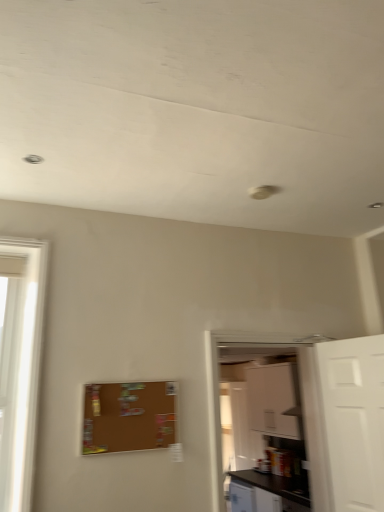
Where is `corkboard at center`? The height and width of the screenshot is (512, 384). corkboard at center is located at coordinates (128, 417).

The image size is (384, 512). Find the location of `white matte door at right`. white matte door at right is located at coordinates (354, 420).

Describe the element at coordinates (274, 400) in the screenshot. I see `white matte cabinet at upper right` at that location.

The height and width of the screenshot is (512, 384). Describe the element at coordinates (304, 406) in the screenshot. I see `white glossy cabinet at right` at that location.

What are the coordinates of `white glossy cabinet at right` in the screenshot? It's located at [x=304, y=406].

You are a GUI agent. You are given a task and a screenshot of the screen. Output one action in this format:
    pyautogui.click(x=<x>, y=<y>)
    Task: Click on the corkboard at center
    
    Given the screenshot: What is the action you would take?
    pyautogui.click(x=128, y=417)

How different are the orientations of white matte cabinet at upper right and corkboard at center in degrees?

The angular difference between white matte cabinet at upper right and corkboard at center is 89.7 degrees.

Is white matte cabinet at upper right looking in the opposite direction of corkboard at center?

white matte cabinet at upper right is not turned away from corkboard at center.

Looking at this image, considering the sizes of white matte cabinet at upper right and corkboard at center in the image, is white matte cabinet at upper right taller or shorter than corkboard at center?

In the image, white matte cabinet at upper right appears to be taller than corkboard at center.

Is white matte cabinet at upper right positioned beyond the bounds of corkboard at center?

Yes.

Is white matte cabinet at upper right positioned in front of black laminate counter top at lower right?

Yes, it is in front of black laminate counter top at lower right.

From a real-world perspective, is white matte cabinet at upper right positioned above or below black laminate counter top at lower right?

white matte cabinet at upper right is situated higher than black laminate counter top at lower right in the real world.

Which is in front, point (251, 381) or point (289, 484)?

The point (289, 484) is more forward.

From the image's perspective, is white matte cabinet at upper right positioned above or below black laminate counter top at lower right?

white matte cabinet at upper right is situated higher than black laminate counter top at lower right in the image.

From a real-world perspective, who is located lower, white matte door at right or white matte cabinet at upper right?

white matte door at right, from a real-world perspective.

From the image's perspective, does white matte door at right appear higher than white matte cabinet at upper right?

Yes, from the image's perspective, white matte door at right is on top of white matte cabinet at upper right.

Between white matte door at right and white matte cabinet at upper right, which one is positioned in front?

white matte door at right.

In terms of width, does black laminate counter top at lower right look wider or thinner when compared to corkboard at center?

black laminate counter top at lower right is wider than corkboard at center.

From a real-world perspective, is black laminate counter top at lower right over corkboard at center?

No, from a real-world perspective, black laminate counter top at lower right is not on top of corkboard at center.

In terms of height, does black laminate counter top at lower right look taller or shorter compared to corkboard at center?

Considering their sizes, black laminate counter top at lower right has more height than corkboard at center.

Which is farther from the camera, (251, 478) or (160, 436)?

The point (251, 478) is more distant.

From a real-world perspective, between white glossy cabinet at right and corkboard at center, who is vertically higher?

From a 3D spatial view, corkboard at center is above.

Could you tell me if white glossy cabinet at right is facing corkboard at center?

No, white glossy cabinet at right is not facing towards corkboard at center.

Is white glossy cabinet at right to the left of corkboard at center from the viewer's perspective?

No, white glossy cabinet at right is not to the left of corkboard at center.

Who is more distant, corkboard at center or white glossy cabinet at right?

white glossy cabinet at right.

Is corkboard at center situated inside white glossy cabinet at right or outside?

corkboard at center is not enclosed by white glossy cabinet at right.

Which object is positioned more to the left, corkboard at center or white glossy cabinet at right?

From the viewer's perspective, corkboard at center appears more on the left side.

From their relative heights in the image, would you say corkboard at center is taller or shorter than white glossy cabinet at right?

Considering their sizes, corkboard at center has less height than white glossy cabinet at right.

Looking at this image, is black laminate counter top at lower right positioned beyond the bounds of white matte door at right?

black laminate counter top at lower right lies outside white matte door at right's area.

Where is `door in front of the black laminate counter top at lower right`? The width and height of the screenshot is (384, 512). door in front of the black laminate counter top at lower right is located at coordinates coord(354,420).

Is black laminate counter top at lower right facing away from white matte door at right?

No, black laminate counter top at lower right is not facing away from white matte door at right.

From the image's perspective, which one is positioned lower, black laminate counter top at lower right or white matte door at right?

black laminate counter top at lower right is shown below in the image.

The width and height of the screenshot is (384, 512). What are the coordinates of `bulletin board above the white matte cabinet at upper right (from the image's perspective)` in the screenshot? It's located at point(128,417).

Locate an element on the screen. cabinetry in front of the black laminate counter top at lower right is located at coordinates (274, 400).

Considering their positions, is white glossy cabinet at right positioned closer to white matte cabinet at upper right than black laminate counter top at lower right?

Based on the image, black laminate counter top at lower right appears to be nearer to white matte cabinet at upper right.

Estimate the real-world distances between objects in this image. Which object is further from white matte cabinet at upper right, corkboard at center or black laminate counter top at lower right?

corkboard at center.

Considering their positions, is white matte door at right positioned closer to white glossy cabinet at right than black laminate counter top at lower right?

white matte door at right lies closer to white glossy cabinet at right than the other object.

Looking at the image, which one is located further to black laminate counter top at lower right, corkboard at center or white matte door at right?

Among the two, corkboard at center is located further to black laminate counter top at lower right.

Which object lies nearer to the anchor point corkboard at center, black laminate counter top at lower right or white matte cabinet at upper right?

Among the two, black laminate counter top at lower right is located nearer to corkboard at center.

Estimate the real-world distances between objects in this image. Which object is further from white matte cabinet at upper right, white glossy cabinet at right or corkboard at center?

corkboard at center is positioned further to the anchor white matte cabinet at upper right.

Looking at the image, which one is located further to white matte door at right, white matte cabinet at upper right or corkboard at center?

Based on the image, white matte cabinet at upper right appears to be further to white matte door at right.

Which object lies further to the anchor point white glossy cabinet at right, corkboard at center or black laminate counter top at lower right?

Based on the image, black laminate counter top at lower right appears to be further to white glossy cabinet at right.

Where is `screen door between white matte door at right and black laminate counter top at lower right from front to back`? This screenshot has width=384, height=512. screen door between white matte door at right and black laminate counter top at lower right from front to back is located at coordinates tap(304, 406).

Locate an element on the screen. This screenshot has height=512, width=384. screen door between corkboard at center and white matte cabinet at upper right in the front-back direction is located at coordinates (304, 406).

I want to click on cabinetry between white glossy cabinet at right and black laminate counter top at lower right from front to back, so click(x=274, y=400).

This screenshot has height=512, width=384. Identify the location of screen door positioned between corkboard at center and black laminate counter top at lower right from near to far. (304, 406).